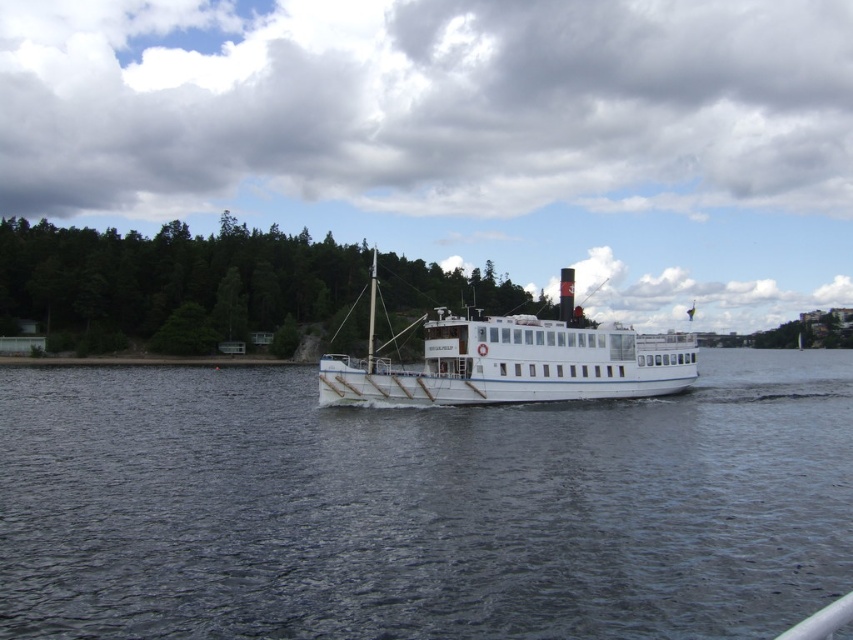
You are standing on the ferry and looking towards the direction of the green leafy trees at left. Based on the coordinates provided, can you determine if the trees are located to the left or right side of the ferry?

The green leafy trees at left are located at coordinates point (x=171, y=282), which places them to the left side of the ferry.

You are standing on the shore and see the green leafy trees at left and the white matte boat at center. Which object is closer to you?

The green leafy trees at left are closer to you because they are further to the viewer than the white matte boat at center, meaning they appear nearer in the visual perspective.

You are a drone operator who needs to capture a photo of the dark blue water at center and the green leafy trees at left. Your drone has a maximum range of 60 meters. Can the drone safely capture both subjects in one photo without exceeding its range?

The distance between the dark blue water at center and green leafy trees at left is 58.40 meters, which is within the drone operator s 60 meter range. Therefore, the drone can safely capture both subjects in one photo without exceeding its range.